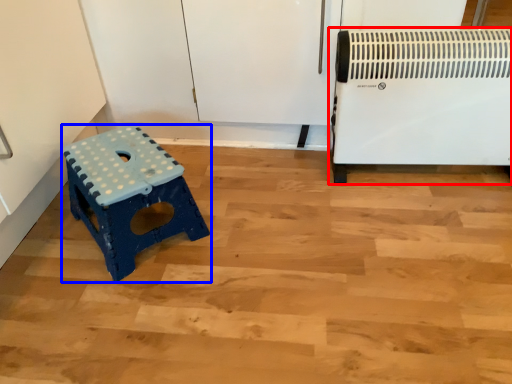
Question: Among these objects, which one is farthest to the camera, home appliance (highlighted by a red box) or furniture (highlighted by a blue box)?

Choices:
 (A) home appliance
 (B) furniture

Answer: (A)